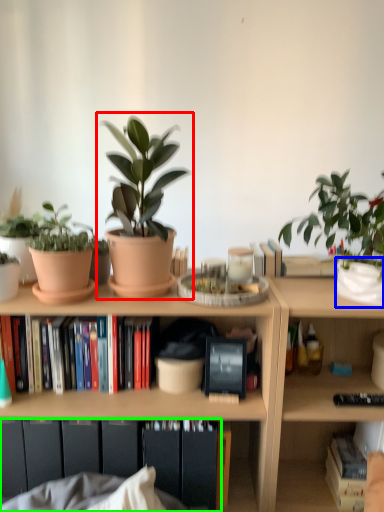
Question: Estimate the real-world distances between objects in this image. Which object is farther from houseplant (highlighted by a red box), flowerpot (highlighted by a blue box) or cabinet (highlighted by a green box)?

Choices:
 (A) flowerpot
 (B) cabinet

Answer: (A)